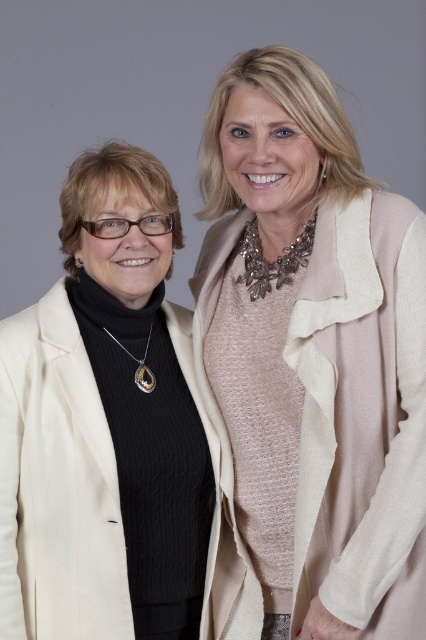
Question: Does matte black turtleneck sweater at left have a greater width compared to beige textured coat at upper right?

Choices:
 (A) yes
 (B) no

Answer: (B)

Question: Can you confirm if matte black turtleneck sweater at left is positioned to the left of beige textured coat at upper right?

Choices:
 (A) no
 (B) yes

Answer: (B)

Question: Does matte black turtleneck sweater at left appear under beige textured coat at upper right?

Choices:
 (A) no
 (B) yes

Answer: (A)

Question: Which object is closer to the camera taking this photo?

Choices:
 (A) beige textured coat at upper right
 (B) matte black turtleneck sweater at left

Answer: (A)

Question: Which object appears closest to the camera in this image?

Choices:
 (A) matte black turtleneck sweater at left
 (B) beige textured coat at upper right

Answer: (B)

Question: Which of the following is the farthest from the observer?

Choices:
 (A) click(388, 444)
 (B) click(71, 481)

Answer: (B)